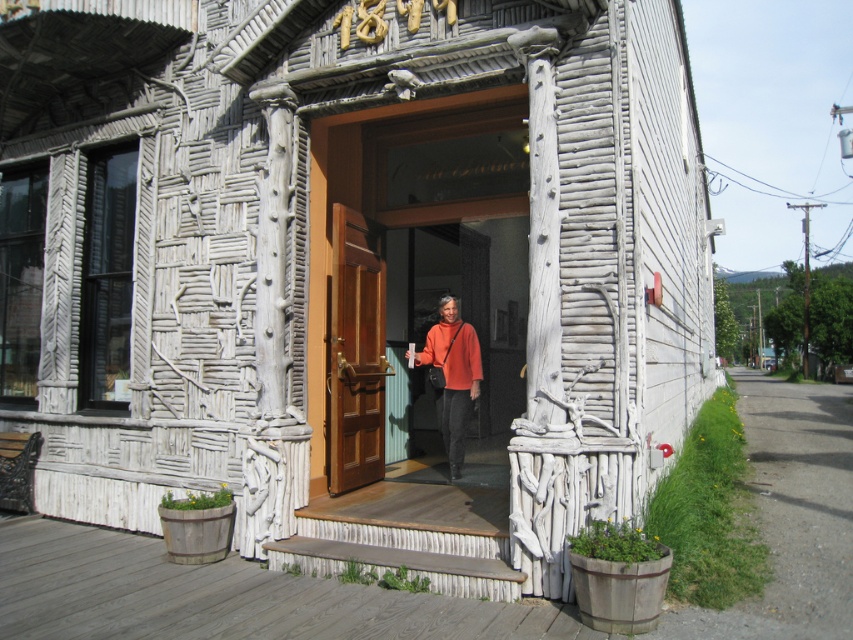
Does brown wooden door at center have a smaller size compared to orange sweater at center?

No, brown wooden door at center is not smaller than orange sweater at center.

Which is more to the right, brown wooden door at center or orange sweater at center?

From the viewer's perspective, orange sweater at center appears more on the right side.

Between point (334, 483) and point (454, 323), which one is positioned behind?

The point (454, 323) is behind.

Find the location of a particular element. brown wooden door at center is located at coordinates (357, 349).